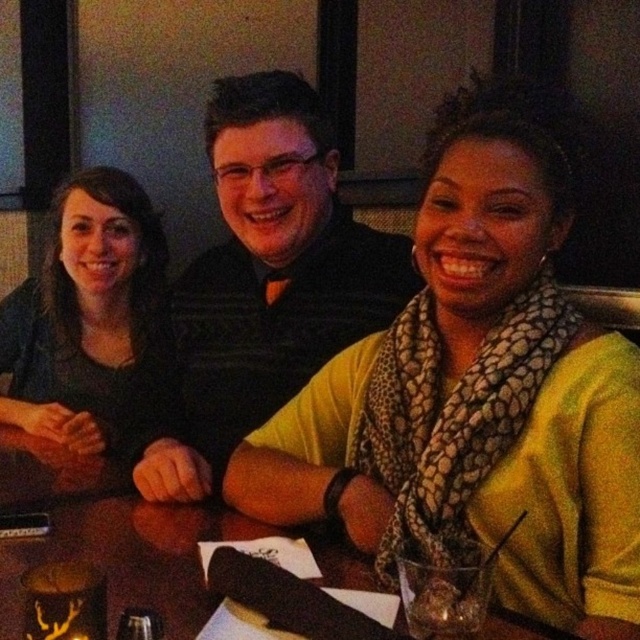
Is point (163, 499) farther from camera compared to point (58, 250)?

No, it is in front of (58, 250).

Who is taller, matte black shirt at center or matte black shirt at left?

matte black shirt at center is taller.

Where is `matte black shirt at center`? matte black shirt at center is located at coordinates (268, 276).

The image size is (640, 640). What are the coordinates of `matte black shirt at center` in the screenshot? It's located at (268, 276).

Does yellow matte scarf at center have a smaller size compared to wooden table at center?

No, yellow matte scarf at center is not smaller than wooden table at center.

Based on the photo, does yellow matte scarf at center have a greater width compared to wooden table at center?

No, yellow matte scarf at center is not wider than wooden table at center.

Where is `yellow matte scarf at center`? yellow matte scarf at center is located at coordinates (477, 387).

Does matte black shirt at center appear over wooden table at center?

Yes.

Is matte black shirt at center shorter than wooden table at center?

No, matte black shirt at center is not shorter than wooden table at center.

The width and height of the screenshot is (640, 640). Identify the location of matte black shirt at center. click(x=268, y=276).

Image resolution: width=640 pixels, height=640 pixels. I want to click on matte black shirt at center, so 268,276.